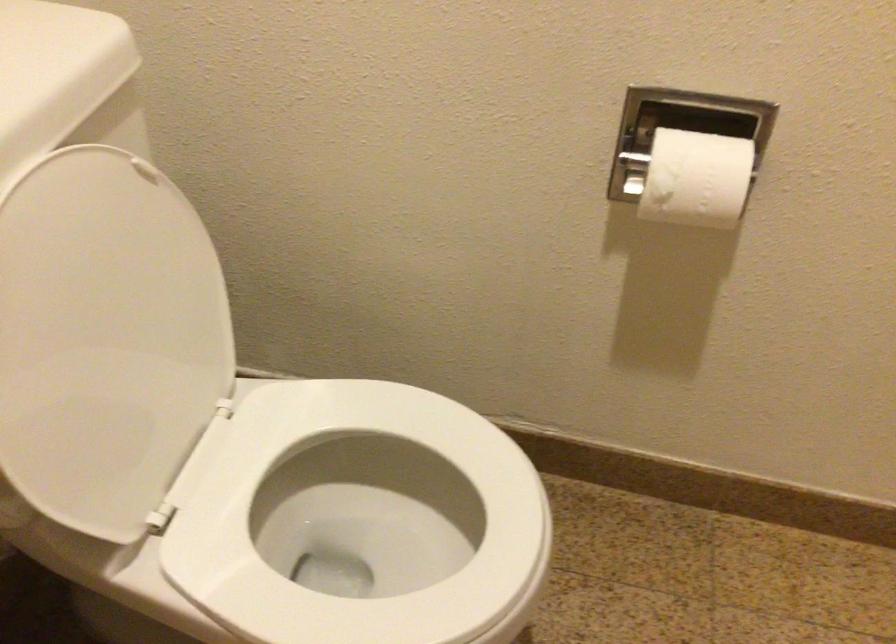
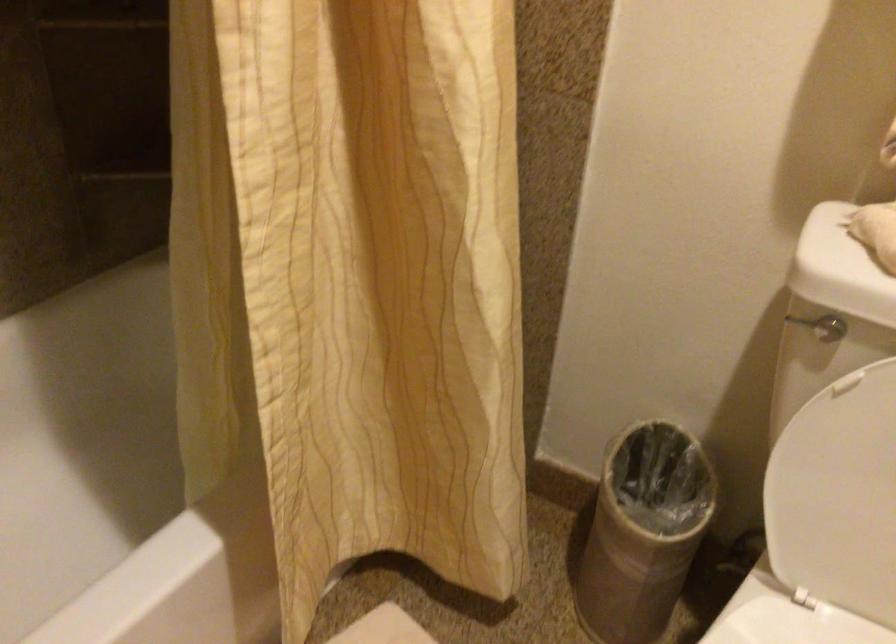
Locate, in the second image, the point that corresponds to the point at 69,428 in the first image.

(834, 480)